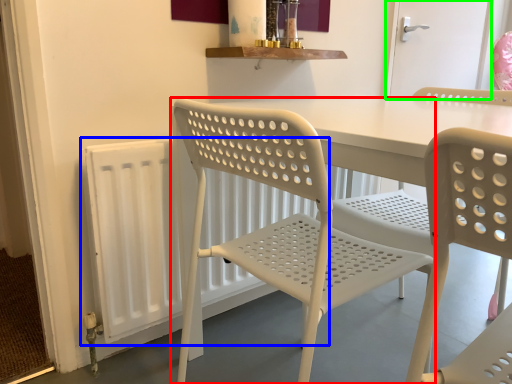
Question: Which is farther away from chair (highlighted by a red box)? radiator (highlighted by a blue box) or screen door (highlighted by a green box)?

Choices:
 (A) radiator
 (B) screen door

Answer: (B)